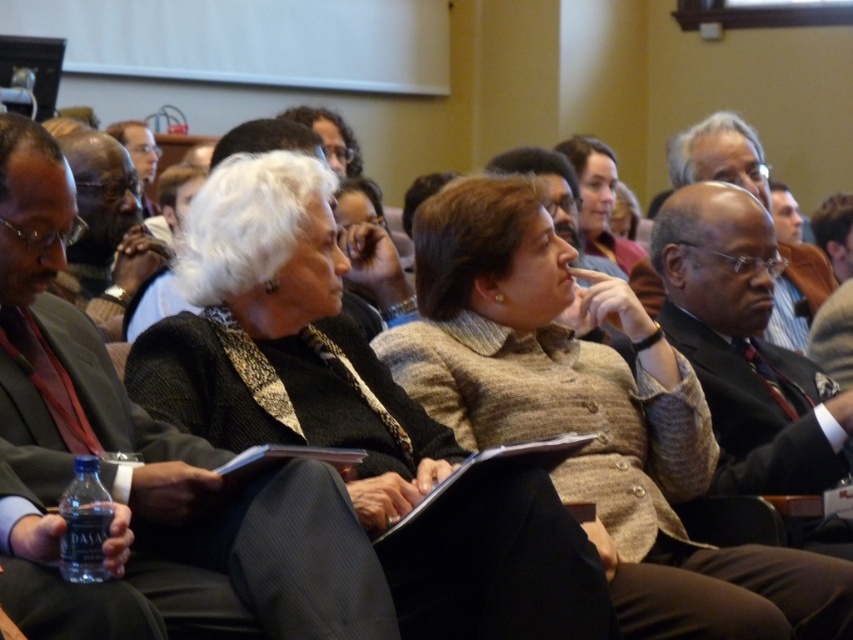
Question: In this image, where is matte black jacket at center located relative to black wool sweater at center?

Choices:
 (A) below
 (B) above

Answer: (B)

Question: Which of these objects is positioned farthest from the brown textured blazer at center?

Choices:
 (A) black wool sweater at center
 (B) matte brown jacket at center
 (C) matte black jacket at center
 (D) matte black clipboard at center

Answer: (B)

Question: Which of the following is the closest to the observer?

Choices:
 (A) black wool sweater at center
 (B) matte black clipboard at center
 (C) brown textured blazer at center

Answer: (A)

Question: In this image, where is brown textured blazer at center located relative to black wool sweater at center?

Choices:
 (A) above
 (B) below

Answer: (B)

Question: Which point appears closest to the camera in this image?

Choices:
 (A) click(x=477, y=461)
 (B) click(x=326, y=317)

Answer: (A)

Question: Can you confirm if black wool sweater at center is bigger than matte black clipboard at center?

Choices:
 (A) no
 (B) yes

Answer: (B)